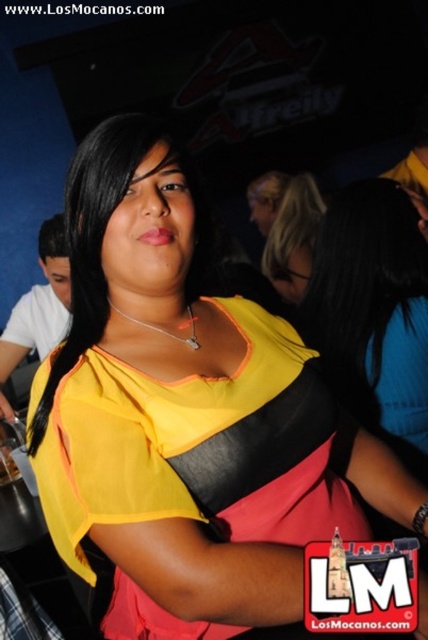
Is the position of yellow matte shirt at center more distant than that of translucent glass beverage at center?

No, it is in front of translucent glass beverage at center.

Which is more to the right, yellow matte shirt at center or translucent glass beverage at center?

Positioned to the right is yellow matte shirt at center.

Is point (339, 232) farther from viewer compared to point (9, 449)?

No, it is in front of (9, 449).

Locate an element on the screen. This screenshot has height=640, width=428. yellow matte shirt at center is located at coordinates (374, 312).

Does yellow matte shirt at center lie in front of matte black hair at upper center?

Yes, yellow matte shirt at center is in front of matte black hair at upper center.

Who is more forward, [369,353] or [300,244]?

Point [369,353] is more forward.

Image resolution: width=428 pixels, height=640 pixels. I want to click on yellow matte shirt at center, so click(374, 312).

Does point (247, 192) come closer to viewer compared to point (2, 451)?

No, it is behind (2, 451).

Which is above, matte black hair at upper center or translucent glass beverage at center?

matte black hair at upper center is higher up.

Is point (262, 189) closer to viewer compared to point (5, 461)?

No, it is behind (5, 461).

Locate an element on the screen. matte black hair at upper center is located at coordinates (287, 228).